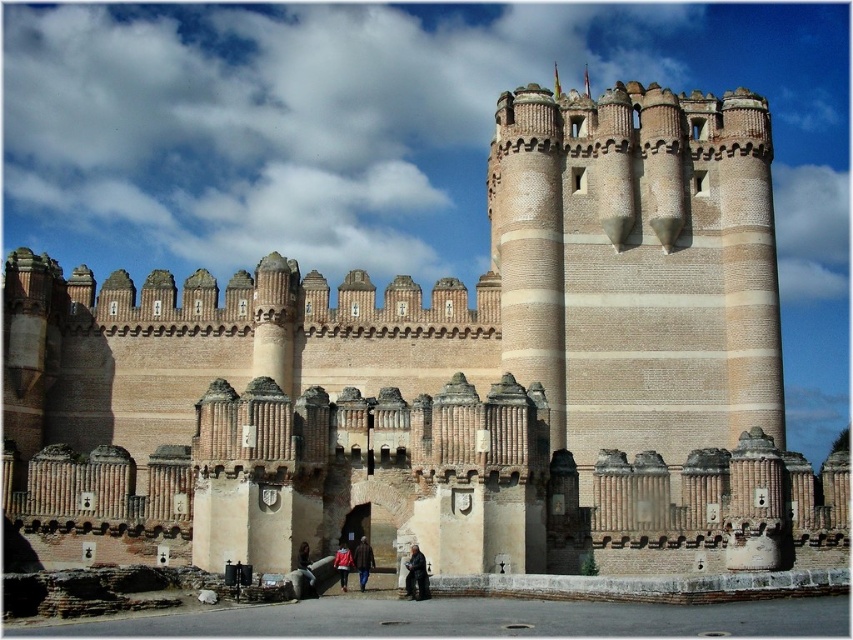
Which of these two, dark brown leather jacket at lower center or red jacket at center, stands taller?

dark brown leather jacket at lower center

This screenshot has height=640, width=853. I want to click on dark brown leather jacket at lower center, so click(416, 576).

Locate an element on the screen. dark brown leather jacket at lower center is located at coordinates (416, 576).

Between dark brown leather jacket at lower center and brown leather jacket at center, which one has less height?

brown leather jacket at center

Between dark brown leather jacket at lower center and brown leather jacket at center, which one appears on the left side from the viewer's perspective?

brown leather jacket at center is more to the left.

Find the location of a particular element. This screenshot has width=853, height=640. dark brown leather jacket at lower center is located at coordinates (416, 576).

I want to click on dark brown leather jacket at lower center, so click(x=416, y=576).

Can you confirm if brown leather jacket at center is shorter than red jacket at center?

In fact, brown leather jacket at center may be taller than red jacket at center.

This screenshot has height=640, width=853. What do you see at coordinates (363, 561) in the screenshot?
I see `brown leather jacket at center` at bounding box center [363, 561].

The width and height of the screenshot is (853, 640). What are the coordinates of `brown leather jacket at center` in the screenshot? It's located at (363, 561).